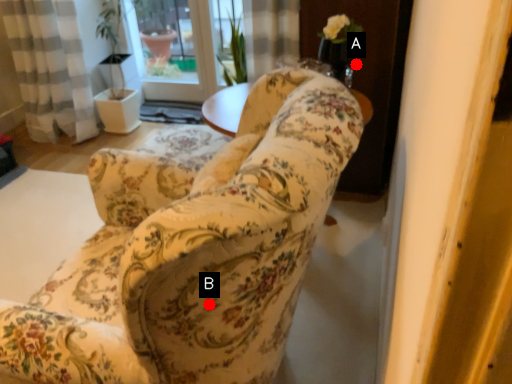
Question: Two points are circled on the image, labeled by A and B beside each circle. Which point is farther to the camera?

Choices:
 (A) A is further
 (B) B is further

Answer: (A)